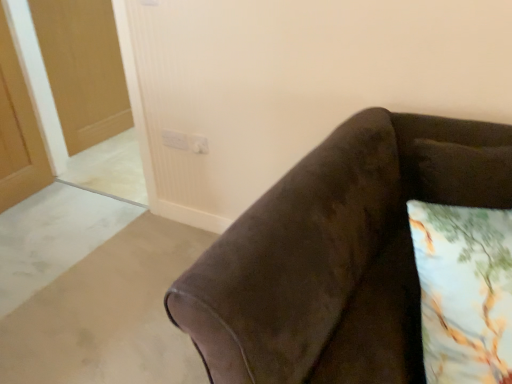
This screenshot has height=384, width=512. Describe the element at coordinates (199, 144) in the screenshot. I see `white plastic electric outlet at upper center, acting as the second electric outlet starting from the left` at that location.

Where is `matte wooden door at upper left`? matte wooden door at upper left is located at coordinates [x=83, y=69].

In order to face white plastic electric outlet at upper center, which is counted as the second electric outlet, starting from the right, should I rotate leftwards or rightwards?

Turn left by 11.039 degrees to look at white plastic electric outlet at upper center, which is counted as the second electric outlet, starting from the right.

Identify the location of printed fabric pillow at lower right. Image resolution: width=512 pixels, height=384 pixels. (464, 291).

Where is `white plastic electric outlet at upper center, acting as the second electric outlet starting from the left`? This screenshot has height=384, width=512. white plastic electric outlet at upper center, acting as the second electric outlet starting from the left is located at coordinates (199, 144).

Between white plastic electric outlet at upper center, which is counted as the second electric outlet, starting from the right, and printed fabric pillow at lower right, which one has smaller width?

white plastic electric outlet at upper center, which is counted as the second electric outlet, starting from the right.

Can we say white plastic electric outlet at upper center, which is counted as the second electric outlet, starting from the right, lies outside printed fabric pillow at lower right?

white plastic electric outlet at upper center, which is counted as the second electric outlet, starting from the right, lies outside printed fabric pillow at lower right's area.

Is white plastic electric outlet at upper center, which is counted as the first electric outlet, starting from the left, positioned with its back to printed fabric pillow at lower right?

No, printed fabric pillow at lower right is not at the back of white plastic electric outlet at upper center, which is counted as the first electric outlet, starting from the left.

Who is bigger, white plastic electric outlet at upper center, which is counted as the first electric outlet, starting from the left, or printed fabric pillow at lower right?

Bigger between the two is printed fabric pillow at lower right.

Considering the relative positions of printed fabric pillow at lower right and white plastic electric outlet at upper center, which is counted as the first electric outlet, starting from the left, in the image provided, is printed fabric pillow at lower right in front of white plastic electric outlet at upper center, which is counted as the first electric outlet, starting from the left,?

Yes, the depth of printed fabric pillow at lower right is less than that of white plastic electric outlet at upper center, which is counted as the first electric outlet, starting from the left.

From the image's perspective, is printed fabric pillow at lower right above or below white plastic electric outlet at upper center, which is counted as the first electric outlet, starting from the left?

printed fabric pillow at lower right is situated lower than white plastic electric outlet at upper center, which is counted as the first electric outlet, starting from the left, in the image.

Which is closer, [454,311] or [165,138]?

The point [454,311] is closer to the camera.

Does matte wooden door at upper left appear on the right side of printed fabric pillow at lower right?

In fact, matte wooden door at upper left is to the left of printed fabric pillow at lower right.

Is matte wooden door at upper left inside or outside of printed fabric pillow at lower right?

matte wooden door at upper left is outside printed fabric pillow at lower right.

Which of these two, printed fabric pillow at lower right or matte wooden door at upper left, stands shorter?

printed fabric pillow at lower right is shorter.

Is printed fabric pillow at lower right inside the boundaries of matte wooden door at upper left, or outside?

printed fabric pillow at lower right is not inside matte wooden door at upper left, it's outside.

Would you say printed fabric pillow at lower right is to the left or to the right of matte wooden door at upper left in the picture?

Based on their positions, printed fabric pillow at lower right is located to the right of matte wooden door at upper left.

Looking at this image, can white plastic electric outlet at upper center, arranged as the first electric outlet when viewed from the right, be found inside white plastic electric outlet at upper center, which is counted as the first electric outlet, starting from the left?

No.

Does white plastic electric outlet at upper center, which is counted as the first electric outlet, starting from the left, have a lesser height compared to white plastic electric outlet at upper center, arranged as the first electric outlet when viewed from the right?

Incorrect, the height of white plastic electric outlet at upper center, which is counted as the first electric outlet, starting from the left, does not fall short of that of white plastic electric outlet at upper center, arranged as the first electric outlet when viewed from the right.

From a real-world perspective, is white plastic electric outlet at upper center, which is counted as the second electric outlet, starting from the right, physically located above or below white plastic electric outlet at upper center, acting as the second electric outlet starting from the left?

white plastic electric outlet at upper center, which is counted as the second electric outlet, starting from the right, is situated higher than white plastic electric outlet at upper center, acting as the second electric outlet starting from the left, in the real world.

Is white plastic electric outlet at upper center, arranged as the first electric outlet when viewed from the right, looking in the opposite direction of printed fabric pillow at lower right?

No.

Considering the sizes of objects white plastic electric outlet at upper center, arranged as the first electric outlet when viewed from the right, and printed fabric pillow at lower right in the image provided, who is bigger, white plastic electric outlet at upper center, arranged as the first electric outlet when viewed from the right, or printed fabric pillow at lower right?

printed fabric pillow at lower right is bigger.

From the image's perspective, who appears lower, white plastic electric outlet at upper center, acting as the second electric outlet starting from the left, or printed fabric pillow at lower right?

From the image's view, printed fabric pillow at lower right is below.

How much distance is there between white plastic electric outlet at upper center, acting as the second electric outlet starting from the left, and printed fabric pillow at lower right?

A distance of 1.42 meters exists between white plastic electric outlet at upper center, acting as the second electric outlet starting from the left, and printed fabric pillow at lower right.

Measure the distance from white plastic electric outlet at upper center, acting as the second electric outlet starting from the left, to white plastic electric outlet at upper center, which is counted as the first electric outlet, starting from the left.

white plastic electric outlet at upper center, acting as the second electric outlet starting from the left, and white plastic electric outlet at upper center, which is counted as the first electric outlet, starting from the left, are 2.99 inches apart.

Can you confirm if white plastic electric outlet at upper center, acting as the second electric outlet starting from the left, is taller than white plastic electric outlet at upper center, which is counted as the first electric outlet, starting from the left?

No.

From the image's perspective, does white plastic electric outlet at upper center, arranged as the first electric outlet when viewed from the right, appear higher than white plastic electric outlet at upper center, which is counted as the first electric outlet, starting from the left?

Incorrect, from the image's perspective, white plastic electric outlet at upper center, arranged as the first electric outlet when viewed from the right, is lower than white plastic electric outlet at upper center, which is counted as the first electric outlet, starting from the left.

Is white plastic electric outlet at upper center, acting as the second electric outlet starting from the left, oriented towards white plastic electric outlet at upper center, which is counted as the second electric outlet, starting from the right?

No, white plastic electric outlet at upper center, acting as the second electric outlet starting from the left, is not aimed at white plastic electric outlet at upper center, which is counted as the second electric outlet, starting from the right.

Identify the location of pillow in front of the white plastic electric outlet at upper center, which is counted as the first electric outlet, starting from the left. tap(464, 291).

The image size is (512, 384). I want to click on electric outlet that is the 2nd one when counting backward from the printed fabric pillow at lower right, so click(x=175, y=140).

Which object lies further to the anchor point white plastic electric outlet at upper center, which is counted as the first electric outlet, starting from the left, printed fabric pillow at lower right or white plastic electric outlet at upper center, arranged as the first electric outlet when viewed from the right?

printed fabric pillow at lower right is further to white plastic electric outlet at upper center, which is counted as the first electric outlet, starting from the left.

Which object lies nearer to the anchor point printed fabric pillow at lower right, matte wooden door at upper left or white plastic electric outlet at upper center, which is counted as the second electric outlet, starting from the right?

white plastic electric outlet at upper center, which is counted as the second electric outlet, starting from the right.

From the image, which object appears to be farther from white plastic electric outlet at upper center, arranged as the first electric outlet when viewed from the right, white plastic electric outlet at upper center, which is counted as the second electric outlet, starting from the right, or matte wooden door at upper left?

Among the two, matte wooden door at upper left is located further to white plastic electric outlet at upper center, arranged as the first electric outlet when viewed from the right.

From the image, which object appears to be farther from white plastic electric outlet at upper center, which is counted as the first electric outlet, starting from the left, matte wooden door at upper left or white plastic electric outlet at upper center, acting as the second electric outlet starting from the left?

matte wooden door at upper left.

From the image, which object appears to be nearer to white plastic electric outlet at upper center, which is counted as the first electric outlet, starting from the left, white plastic electric outlet at upper center, acting as the second electric outlet starting from the left, or matte wooden door at upper left?

white plastic electric outlet at upper center, acting as the second electric outlet starting from the left, is positioned closer to the anchor white plastic electric outlet at upper center, which is counted as the first electric outlet, starting from the left.

Looking at the image, which one is located closer to matte wooden door at upper left, white plastic electric outlet at upper center, which is counted as the second electric outlet, starting from the right, or white plastic electric outlet at upper center, acting as the second electric outlet starting from the left?

Based on the image, white plastic electric outlet at upper center, which is counted as the second electric outlet, starting from the right, appears to be nearer to matte wooden door at upper left.

From the image, which object appears to be farther from printed fabric pillow at lower right, white plastic electric outlet at upper center, which is counted as the second electric outlet, starting from the right, or matte wooden door at upper left?

Based on the image, matte wooden door at upper left appears to be further to printed fabric pillow at lower right.

Estimate the real-world distances between objects in this image. Which object is further from white plastic electric outlet at upper center, acting as the second electric outlet starting from the left, printed fabric pillow at lower right or matte wooden door at upper left?

The object further to white plastic electric outlet at upper center, acting as the second electric outlet starting from the left, is matte wooden door at upper left.

This screenshot has width=512, height=384. I want to click on electric outlet located between matte wooden door at upper left and white plastic electric outlet at upper center, arranged as the first electric outlet when viewed from the right, in the left-right direction, so click(175, 140).

This screenshot has height=384, width=512. I want to click on electric outlet between printed fabric pillow at lower right and white plastic electric outlet at upper center, which is counted as the second electric outlet, starting from the right, from front to back, so click(x=199, y=144).